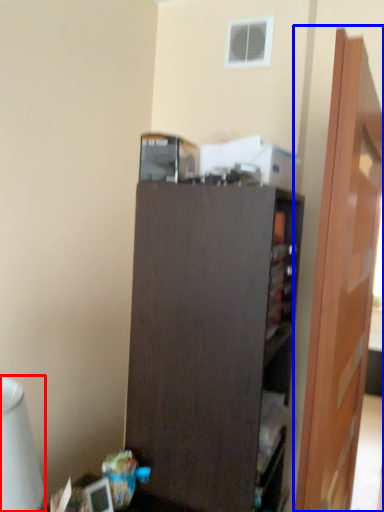
Question: Among these objects, which one is farthest to the camera, table lamp (highlighted by a red box) or door (highlighted by a blue box)?

Choices:
 (A) table lamp
 (B) door

Answer: (B)